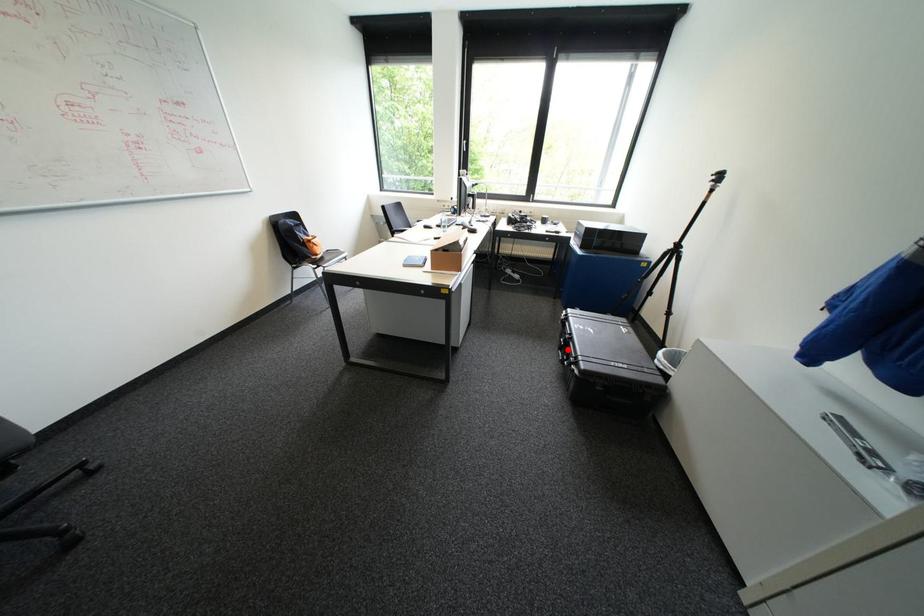
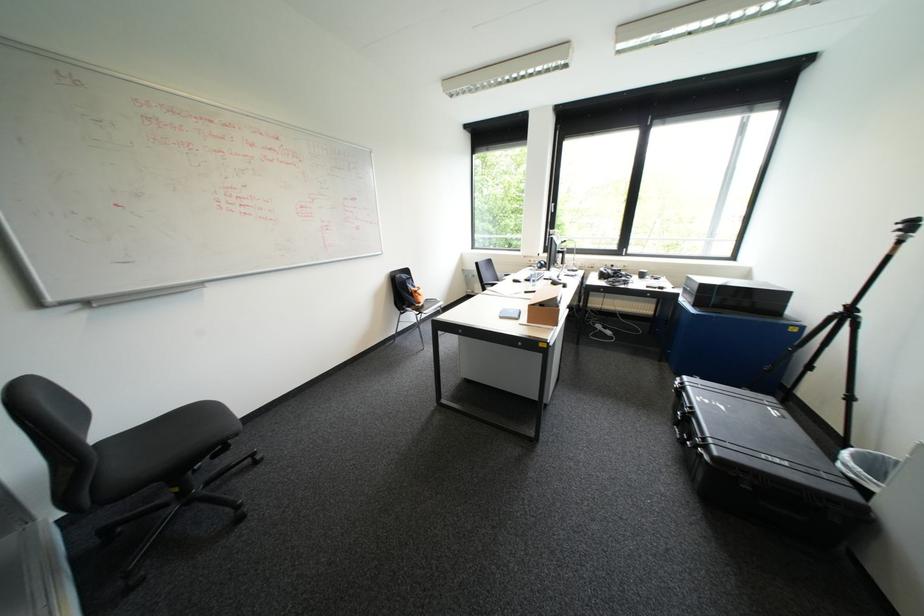
The point at the highlighted location is marked in the first image. Where is the corresponding point in the second image?

(684, 426)